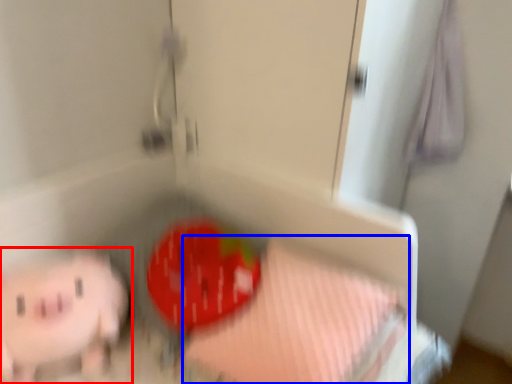
Question: Which point is further to the camera, toy (highlighted by a red box) or sheet (highlighted by a blue box)?

Choices:
 (A) toy
 (B) sheet

Answer: (A)